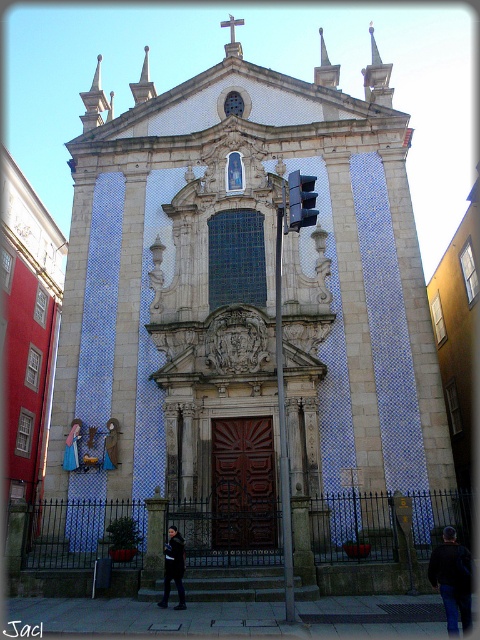
Question: Which object appears closest to the camera in this image?

Choices:
 (A) black fabric jacket at lower center
 (B) dark brown leather jacket at center

Answer: (A)

Question: Which of the following is the closest to the observer?

Choices:
 (A) dark brown leather jacket at center
 (B) black fabric jacket at lower center

Answer: (B)

Question: Among these points, which one is nearest to the camera?

Choices:
 (A) (450, 538)
 (B) (179, 556)

Answer: (A)

Question: Does black fabric jacket at lower center come behind dark brown leather jacket at center?

Choices:
 (A) no
 (B) yes

Answer: (A)

Question: Considering the relative positions of black fabric jacket at lower center and dark brown leather jacket at center in the image provided, where is black fabric jacket at lower center located with respect to dark brown leather jacket at center?

Choices:
 (A) right
 (B) left

Answer: (A)

Question: Does black fabric jacket at lower center have a larger size compared to dark brown leather jacket at center?

Choices:
 (A) no
 (B) yes

Answer: (B)